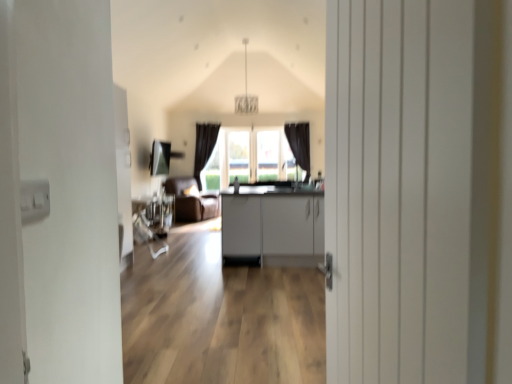
Question: Are matte gray cabinets at center and white wooden door at center far apart?

Choices:
 (A) yes
 (B) no

Answer: (A)

Question: Considering the relative positions of matte gray cabinets at center and white wooden door at center in the image provided, is matte gray cabinets at center behind white wooden door at center?

Choices:
 (A) no
 (B) yes

Answer: (B)

Question: Does matte gray cabinets at center have a greater width compared to white wooden door at center?

Choices:
 (A) yes
 (B) no

Answer: (A)

Question: Considering the relative sizes of matte gray cabinets at center and white wooden door at center in the image provided, is matte gray cabinets at center smaller than white wooden door at center?

Choices:
 (A) no
 (B) yes

Answer: (A)

Question: Can white wooden door at center be found inside matte gray cabinets at center?

Choices:
 (A) no
 (B) yes

Answer: (A)

Question: In terms of size, does matte gray cabinets at center appear bigger or smaller than white wooden door at center?

Choices:
 (A) small
 (B) big

Answer: (B)

Question: Is matte gray cabinets at center in front of or behind white wooden door at center in the image?

Choices:
 (A) behind
 (B) front

Answer: (A)

Question: Considering the positions of matte gray cabinets at center and white wooden door at center in the image, is matte gray cabinets at center wider or thinner than white wooden door at center?

Choices:
 (A) wide
 (B) thin

Answer: (A)

Question: In terms of height, does matte gray cabinets at center look taller or shorter compared to white wooden door at center?

Choices:
 (A) short
 (B) tall

Answer: (A)

Question: In the image, is white wooden door at center positioned in front of or behind brown leather armchair at center?

Choices:
 (A) front
 (B) behind

Answer: (A)

Question: From a real-world perspective, is white wooden door at center physically located above or below brown leather armchair at center?

Choices:
 (A) below
 (B) above

Answer: (B)

Question: From their relative heights in the image, would you say white wooden door at center is taller or shorter than brown leather armchair at center?

Choices:
 (A) short
 (B) tall

Answer: (B)

Question: In the image, is white wooden door at center on the left side or the right side of brown leather armchair at center?

Choices:
 (A) right
 (B) left

Answer: (A)

Question: Looking at their shapes, would you say brown leather armchair at center is wider or thinner than matte gray cabinets at center?

Choices:
 (A) wide
 (B) thin

Answer: (B)

Question: Considering their positions, is brown leather armchair at center located in front of or behind matte gray cabinets at center?

Choices:
 (A) front
 (B) behind

Answer: (B)